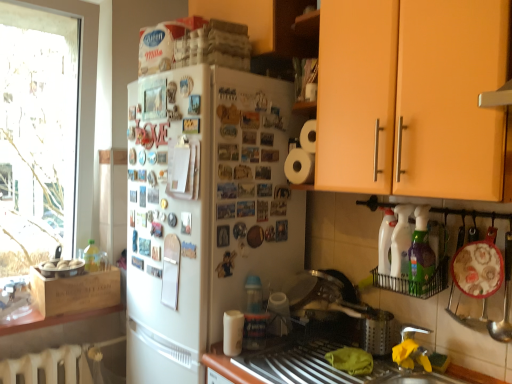
Question: Should I look upward or downward to see metallic silver sink at lower center?

Choices:
 (A) up
 (B) down

Answer: (B)

Question: Is white matte refrigerator at center far from orange matte cabinet at upper right?

Choices:
 (A) no
 (B) yes

Answer: (A)

Question: Could orange matte cabinet at upper right be considered to be inside white matte refrigerator at center?

Choices:
 (A) yes
 (B) no

Answer: (B)

Question: Is white matte refrigerator at center positioned beyond the bounds of orange matte cabinet at upper right?

Choices:
 (A) yes
 (B) no

Answer: (A)

Question: Is white matte refrigerator at center facing towards orange matte cabinet at upper right?

Choices:
 (A) yes
 (B) no

Answer: (B)

Question: Considering the relative sizes of white matte refrigerator at center and orange matte cabinet at upper right in the image provided, is white matte refrigerator at center smaller than orange matte cabinet at upper right?

Choices:
 (A) no
 (B) yes

Answer: (A)

Question: Can you confirm if white matte refrigerator at center is wider than orange matte cabinet at upper right?

Choices:
 (A) no
 (B) yes

Answer: (B)

Question: Is transparent glass window at left to the right of silver metallic faucet at lower right from the viewer's perspective?

Choices:
 (A) yes
 (B) no

Answer: (B)

Question: Is transparent glass window at left placed right next to silver metallic faucet at lower right?

Choices:
 (A) yes
 (B) no

Answer: (B)

Question: Is transparent glass window at left oriented away from silver metallic faucet at lower right?

Choices:
 (A) no
 (B) yes

Answer: (A)

Question: From a real-world perspective, is transparent glass window at left below silver metallic faucet at lower right?

Choices:
 (A) yes
 (B) no

Answer: (B)

Question: Is transparent glass window at left positioned beyond the bounds of silver metallic faucet at lower right?

Choices:
 (A) yes
 (B) no

Answer: (A)

Question: Does transparent glass window at left lie in front of silver metallic faucet at lower right?

Choices:
 (A) yes
 (B) no

Answer: (B)

Question: Is transparent glass window at left completely or partially inside silver metallic faucet at lower right?

Choices:
 (A) no
 (B) yes

Answer: (A)